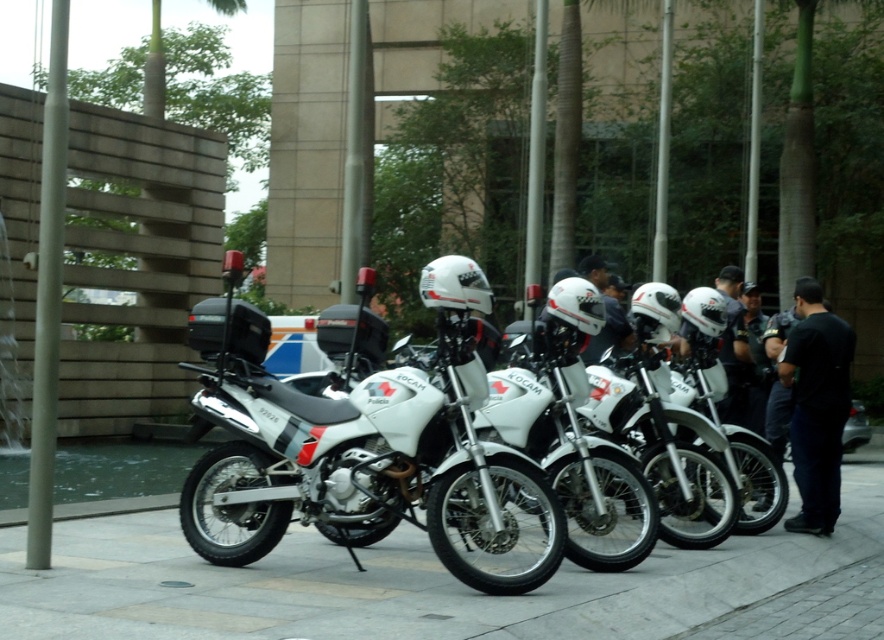
Does gray concrete pavement at center have a lesser width compared to white matte motorcycle at center?

Correct, gray concrete pavement at center's width is less than white matte motorcycle at center's.

Is gray concrete pavement at center wider than white matte motorcycle at center?

In fact, gray concrete pavement at center might be narrower than white matte motorcycle at center.

Is point (578, 609) closer to viewer compared to point (410, 452)?

That is True.

Identify the location of gray concrete pavement at center. (402, 582).

What do you see at coordinates (375, 456) in the screenshot?
I see `white matte motorcycle at center` at bounding box center [375, 456].

Looking at this image, who is more distant from viewer, (435, 499) or (809, 474)?

Positioned behind is point (809, 474).

Where is `white matte motorcycle at center`? Image resolution: width=884 pixels, height=640 pixels. white matte motorcycle at center is located at coordinates (375, 456).

Does point (299, 547) come closer to viewer compared to point (843, 387)?

Yes, point (299, 547) is closer to viewer.

The image size is (884, 640). Identify the location of gray concrete pavement at center. (402, 582).